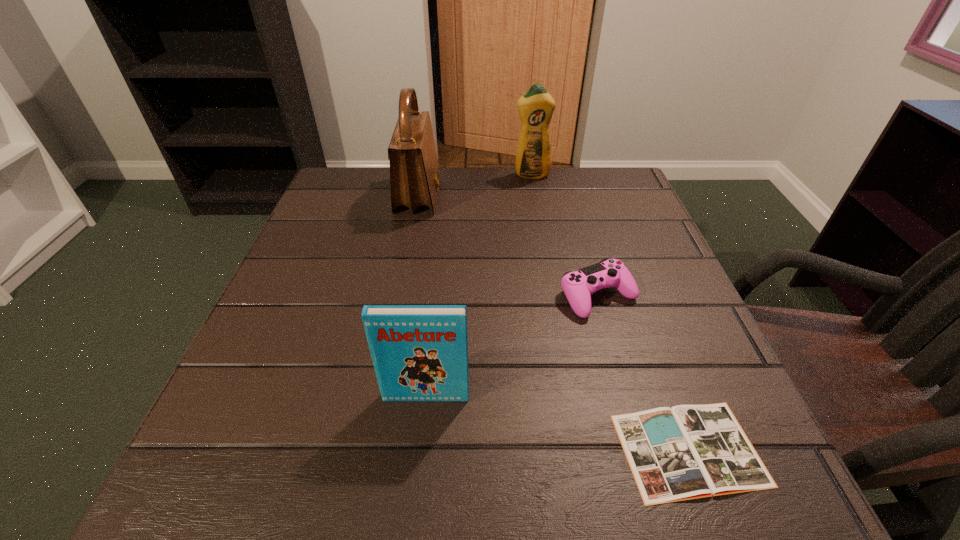
Where is `free spot between the nearest object and the second nearest object`? free spot between the nearest object and the second nearest object is located at coordinates (558, 423).

Where is `free space between the nearer book and the detergent`? free space between the nearer book and the detergent is located at coordinates (x=611, y=312).

The image size is (960, 540). I want to click on free space between the control and the detergent, so click(x=564, y=235).

Where is `vacant space that's between the detergent and the second shortest object`? The image size is (960, 540). vacant space that's between the detergent and the second shortest object is located at coordinates (x=564, y=235).

At what (x,y) coordinates should I click in order to perform the action: click on free space between the shoulder bag and the detergent. Please return your answer as a coordinate pair (x, y). The width and height of the screenshot is (960, 540). Looking at the image, I should click on (475, 185).

Identify which object is the nearest to the third shortest object. Please provide its 2D coordinates. Your answer should be formatted as a tuple, i.e. [(x, y)], where the tuple contains the x and y coordinates of a point satisfying the conditions above.

[(685, 452)]

Locate which object is the closest to the shorter book. Please provide its 2D coordinates. Your answer should be formatted as a tuple, i.e. [(x, y)], where the tuple contains the x and y coordinates of a point satisfying the conditions above.

[(578, 286)]

Locate an element on the screen. This screenshot has width=960, height=540. vacant space that satisfies the following two spatial constraints: 1. on the front side of the shorter book; 2. on the left side of the second shortest object is located at coordinates (641, 450).

Locate an element on the screen. The height and width of the screenshot is (540, 960). free point that satisfies the following two spatial constraints: 1. on the label of the detergent; 2. on the right side of the nearest object is located at coordinates (580, 450).

Find the location of `free spot that satisfies the following two spatial constraints: 1. on the front cover of the second nearest object; 2. on the left side of the right book`. free spot that satisfies the following two spatial constraints: 1. on the front cover of the second nearest object; 2. on the left side of the right book is located at coordinates (420, 450).